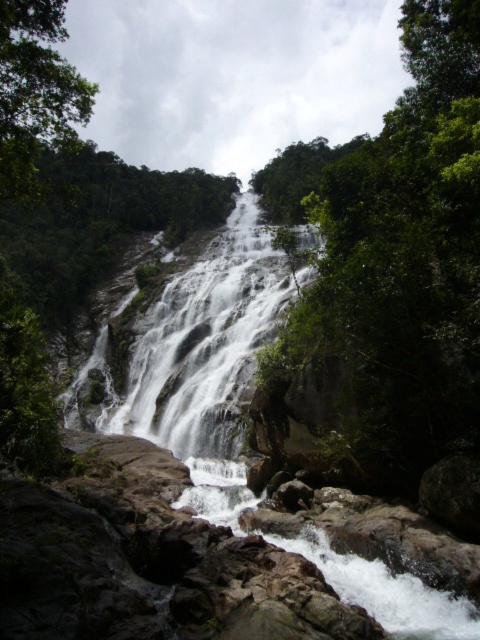
Question: Which of the following is the closest to the observer?

Choices:
 (A) (334, 244)
 (B) (201, 330)
 (C) (11, 154)

Answer: (C)

Question: Does white frothy water at center appear under green leafy tree at upper left?

Choices:
 (A) yes
 (B) no

Answer: (A)

Question: Does green leafy tree at center appear on the right side of white textured waterfall at center?

Choices:
 (A) no
 (B) yes

Answer: (B)

Question: Based on their relative distances, which object is nearer to the green leafy tree at center?

Choices:
 (A) white frothy water at center
 (B) green leafy tree at upper left

Answer: (A)

Question: Which object is farther from the camera taking this photo?

Choices:
 (A) green leafy tree at center
 (B) white frothy water at center

Answer: (A)

Question: Is green leafy tree at center to the left of green leafy tree at upper left from the viewer's perspective?

Choices:
 (A) no
 (B) yes

Answer: (A)